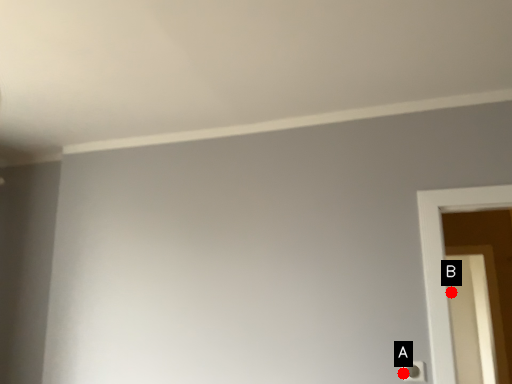
Question: Two points are circled on the image, labeled by A and B beside each circle. Which point is farther from the camera taking this photo?

Choices:
 (A) A is further
 (B) B is further

Answer: (B)